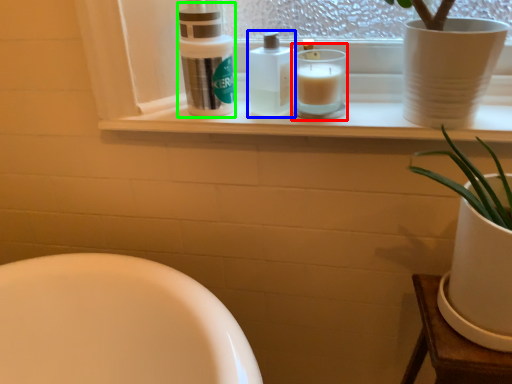
Question: Considering the real-world distances, which object is farthest from candle holder (highlighted by a red box)? toiletry (highlighted by a blue box) or cleaning product (highlighted by a green box)?

Choices:
 (A) toiletry
 (B) cleaning product

Answer: (B)